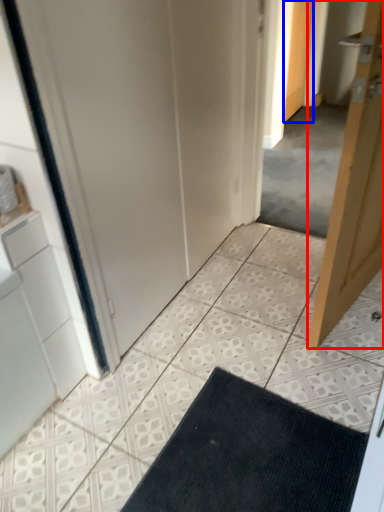
Question: Which object is closer to the camera taking this photo, door (highlighted by a red box) or door (highlighted by a blue box)?

Choices:
 (A) door
 (B) door

Answer: (A)